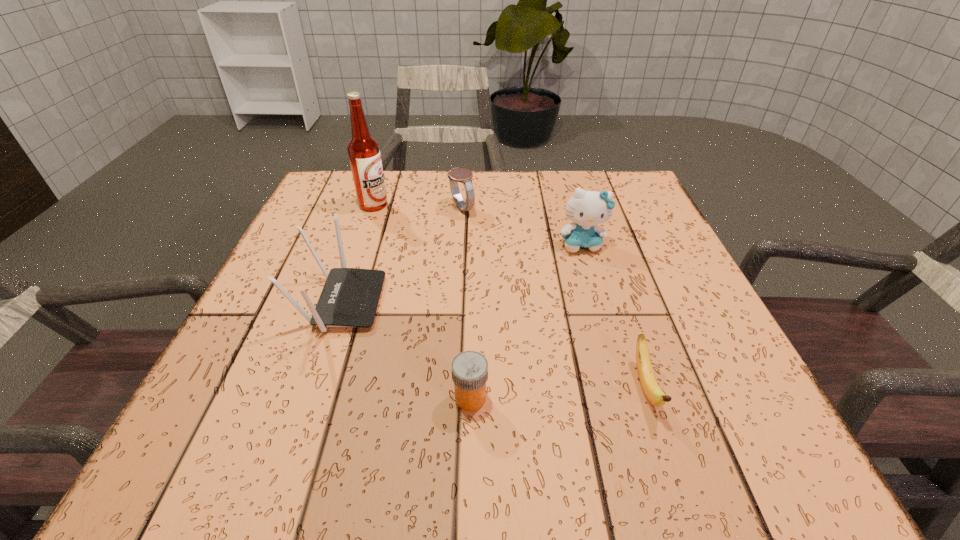
At what (x,y) coordinates should I click in order to perform the action: click on blank space at the near edge of the desktop. Please return your answer as a coordinate pair (x, y). The width and height of the screenshot is (960, 540). Looking at the image, I should click on (471, 432).

At what (x,y) coordinates should I click in order to perform the action: click on vacant area at the left edge. Please return your answer as a coordinate pair (x, y). The width and height of the screenshot is (960, 540). Looking at the image, I should click on (274, 295).

Image resolution: width=960 pixels, height=540 pixels. In order to click on free space at the right edge of the desktop in this screenshot , I will do `click(634, 248)`.

This screenshot has height=540, width=960. I want to click on empty space that is in between the fourth farthest object and the fourth tallest object, so click(x=401, y=255).

The image size is (960, 540). I want to click on unoccupied position between the third farthest object and the banana, so click(613, 315).

Where is `vacant area that lies between the banana and the third shortest object`? The image size is (960, 540). vacant area that lies between the banana and the third shortest object is located at coordinates (554, 298).

You are a GUI agent. You are given a task and a screenshot of the screen. Output one action in this format:
    pyautogui.click(x=<x>, y=<y>)
    Task: Click on the free space between the fourth farthest object and the third shortest object
    Image resolution: width=960 pixels, height=540 pixels.
    Given the screenshot: What is the action you would take?
    pyautogui.click(x=401, y=255)

Where is `vacant area between the banana and the fourth tallest object`? This screenshot has height=540, width=960. vacant area between the banana and the fourth tallest object is located at coordinates (554, 298).

The image size is (960, 540). What are the coordinates of `vacant space that is in between the shortest object and the tallest object` in the screenshot? It's located at (509, 296).

Where is `unoccupied area between the watch and the router`? unoccupied area between the watch and the router is located at coordinates (401, 255).